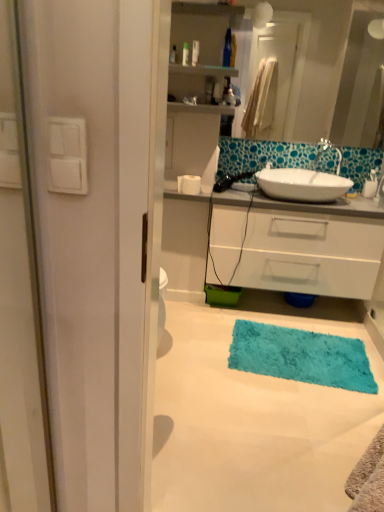
Identify the location of vacant space to the right of white matte toilet paper at center. This screenshot has height=512, width=384. (217, 194).